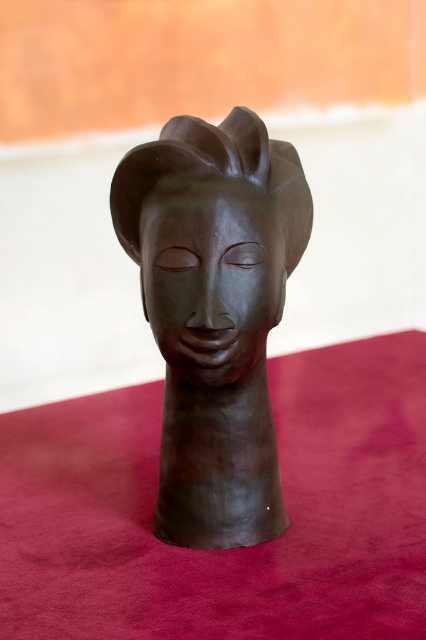
Locate an element on the screen. Image resolution: width=426 pixels, height=640 pixels. matte bronze head at center is located at coordinates (215, 314).

Describe the element at coordinates (215, 314) in the screenshot. The width and height of the screenshot is (426, 640). I see `matte bronze head at center` at that location.

The height and width of the screenshot is (640, 426). Identify the location of matte bronze head at center. (215, 314).